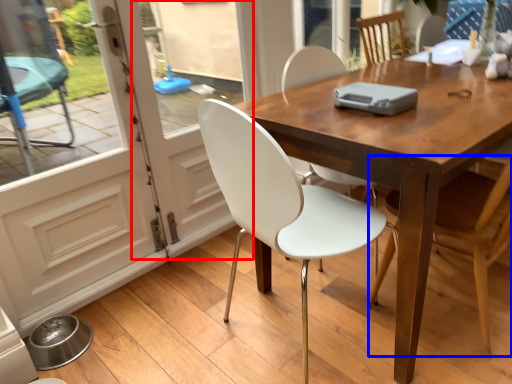
Question: Among these objects, which one is nearest to the camera, screen door (highlighted by a red box) or chair (highlighted by a blue box)?

Choices:
 (A) screen door
 (B) chair

Answer: (B)